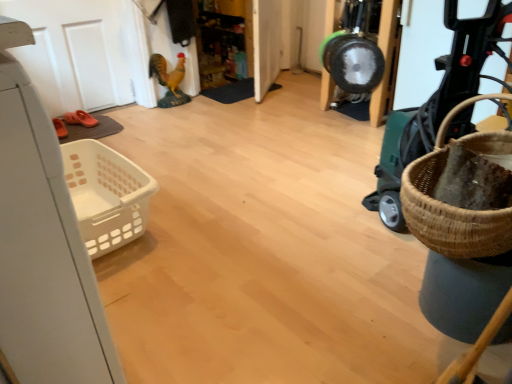
This screenshot has height=384, width=512. What do you see at coordinates (436, 104) in the screenshot?
I see `green plastic baby carriage at right` at bounding box center [436, 104].

At what (x,y) coordinates should I click in order to perform the action: click on orange rubber sandal at left. Please return your answer as a coordinate pair (x, y). The height and width of the screenshot is (384, 512). Looking at the image, I should click on (80, 119).

You are a GUI agent. You are given a task and a screenshot of the screen. Output one action in this format:
    pyautogui.click(x=<x>, y=<y>)
    Task: Click on the door located in front of the orange rubber sandal at left
    
    Given the screenshot: What is the action you would take?
    pyautogui.click(x=74, y=53)

Who is shorter, white matte door at upper left, which ranks as the 1th door in left-to-right order, or orange rubber sandal at left?

With less height is orange rubber sandal at left.

Between white matte door at upper left, acting as the 2th door starting from the right, and orange rubber sandal at left, which one has smaller width?

white matte door at upper left, acting as the 2th door starting from the right, is thinner.

Is white matte door at upper left, acting as the 2th door starting from the right, inside or outside of orange rubber sandal at left?

white matte door at upper left, acting as the 2th door starting from the right, cannot be found inside orange rubber sandal at left.

Is the surface of shiny plastic rooster at upper center in direct contact with green plastic baby carriage at right?

No, shiny plastic rooster at upper center is not touching green plastic baby carriage at right.

Between shiny plastic rooster at upper center and green plastic baby carriage at right, which one is positioned in front?

green plastic baby carriage at right is more forward.

I want to click on baby carriage that is above the shiny plastic rooster at upper center (from a real-world perspective), so click(436, 104).

Who is taller, shiny plastic rooster at upper center or green plastic baby carriage at right?

With more height is green plastic baby carriage at right.

Can you confirm if orange rubber sandal at left is positioned to the left of white glossy door at center, which ranks as the 1th door in right-to-left order?

Yes.

Find the location of a particular element. door on the right of orange rubber sandal at left is located at coordinates (266, 44).

Is the depth of orange rubber sandal at left less than that of white glossy door at center, which ranks as the 1th door in right-to-left order?

Yes, it is in front of white glossy door at center, which ranks as the 1th door in right-to-left order.

Which is in front, point (86, 121) or point (271, 54)?

The point (86, 121) is more forward.

Is white glossy door at center, which ranks as the 1th door in right-to-left order, placed right next to shiny plastic rooster at upper center?

No, white glossy door at center, which ranks as the 1th door in right-to-left order, is not touching shiny plastic rooster at upper center.

Considering the relative sizes of white glossy door at center, the second door when ordered from left to right, and shiny plastic rooster at upper center in the image provided, is white glossy door at center, the second door when ordered from left to right, wider than shiny plastic rooster at upper center?

No, white glossy door at center, the second door when ordered from left to right, is not wider than shiny plastic rooster at upper center.

From the image's perspective, is white glossy door at center, the second door when ordered from left to right, over shiny plastic rooster at upper center?

Correct, white glossy door at center, the second door when ordered from left to right, appears higher than shiny plastic rooster at upper center in the image.

Considering the positions of objects orange rubber sandal at left and green plastic baby carriage at right in the image provided, who is behind, orange rubber sandal at left or green plastic baby carriage at right?

Positioned behind is orange rubber sandal at left.

Looking at this image, can you tell me how much orange rubber sandal at left and green plastic baby carriage at right differ in facing direction?

orange rubber sandal at left and green plastic baby carriage at right are facing 142 degrees away from each other.

From the image's perspective, is orange rubber sandal at left above or below green plastic baby carriage at right?

orange rubber sandal at left is above green plastic baby carriage at right.

Does point (73, 119) come behind point (383, 221)?

Yes, it is.

Are white matte door at upper left, which ranks as the 1th door in left-to-right order, and shiny plastic rooster at upper center far apart?

No.

Consider the image. Considering the sizes of objects white matte door at upper left, acting as the 2th door starting from the right, and shiny plastic rooster at upper center in the image provided, who is taller, white matte door at upper left, acting as the 2th door starting from the right, or shiny plastic rooster at upper center?

white matte door at upper left, acting as the 2th door starting from the right, is taller.

Locate an element on the screen. The image size is (512, 384). toy that appears on the right of white matte door at upper left, acting as the 2th door starting from the right is located at coordinates (169, 80).

From the image's perspective, is white matte door at upper left, which ranks as the 1th door in left-to-right order, on top of shiny plastic rooster at upper center?

Indeed, from the image's perspective, white matte door at upper left, which ranks as the 1th door in left-to-right order, is shown above shiny plastic rooster at upper center.

Find the location of a particular element. The width and height of the screenshot is (512, 384). door lying on the right of white matte door at upper left, acting as the 2th door starting from the right is located at coordinates (266, 44).

What's the angular difference between white matte door at upper left, acting as the 2th door starting from the right, and white glossy door at center, the second door when ordered from left to right,'s facing directions?

142 degrees.

From the image's perspective, which object appears higher, white matte door at upper left, which ranks as the 1th door in left-to-right order, or white glossy door at center, which ranks as the 1th door in right-to-left order?

From the image's view, white glossy door at center, which ranks as the 1th door in right-to-left order, is above.

What are the coordinates of `the 1st door above when counting from the orange rubber sandal at left (from the image's perspective)` in the screenshot? It's located at (74, 53).

The height and width of the screenshot is (384, 512). Find the location of `baby carriage that appears in front of the shiny plastic rooster at upper center`. baby carriage that appears in front of the shiny plastic rooster at upper center is located at coordinates (436, 104).

Which object lies nearer to the anchor point green plastic baby carriage at right, white glossy door at center, which ranks as the 1th door in right-to-left order, or shiny plastic rooster at upper center?

white glossy door at center, which ranks as the 1th door in right-to-left order, lies closer to green plastic baby carriage at right than the other object.

Estimate the real-world distances between objects in this image. Which object is closer to white matte door at upper left, acting as the 2th door starting from the right, green plastic baby carriage at right or orange rubber sandal at left?

Based on the image, orange rubber sandal at left appears to be nearer to white matte door at upper left, acting as the 2th door starting from the right.

From the image, which object appears to be nearer to shiny plastic rooster at upper center, orange rubber sandal at left or white glossy door at center, the second door when ordered from left to right?

Among the two, orange rubber sandal at left is located nearer to shiny plastic rooster at upper center.

Estimate the real-world distances between objects in this image. Which object is further from orange rubber sandal at left, green plastic baby carriage at right or shiny plastic rooster at upper center?

Based on the image, green plastic baby carriage at right appears to be further to orange rubber sandal at left.

Based on their spatial positions, is green plastic baby carriage at right or white matte door at upper left, acting as the 2th door starting from the right, closer to shiny plastic rooster at upper center?

white matte door at upper left, acting as the 2th door starting from the right, lies closer to shiny plastic rooster at upper center than the other object.

Based on their spatial positions, is white glossy door at center, the second door when ordered from left to right, or white matte door at upper left, which ranks as the 1th door in left-to-right order, closer to green plastic baby carriage at right?

white glossy door at center, the second door when ordered from left to right, is closer to green plastic baby carriage at right.

From the image, which object appears to be farther from shiny plastic rooster at upper center, orange rubber sandal at left or green plastic baby carriage at right?

The object further to shiny plastic rooster at upper center is green plastic baby carriage at right.

Looking at the image, which one is located closer to green plastic baby carriage at right, white glossy door at center, the second door when ordered from left to right, or orange rubber sandal at left?

Among the two, white glossy door at center, the second door when ordered from left to right, is located nearer to green plastic baby carriage at right.

At what (x,y) coordinates should I click in order to perform the action: click on footwear situated between white matte door at upper left, which ranks as the 1th door in left-to-right order, and shiny plastic rooster at upper center from left to right. Please return your answer as a coordinate pair (x, y). The height and width of the screenshot is (384, 512). Looking at the image, I should click on (80, 119).

The height and width of the screenshot is (384, 512). What are the coordinates of `toy between orange rubber sandal at left and white glossy door at center, the second door when ordered from left to right, in the horizontal direction` in the screenshot? It's located at [x=169, y=80].

Where is `toy situated between white matte door at upper left, which ranks as the 1th door in left-to-right order, and white glossy door at center, which ranks as the 1th door in right-to-left order, from left to right`? toy situated between white matte door at upper left, which ranks as the 1th door in left-to-right order, and white glossy door at center, which ranks as the 1th door in right-to-left order, from left to right is located at coordinates (169, 80).

Find the location of `toy situated between white matte door at upper left, which ranks as the 1th door in left-to-right order, and green plastic baby carriage at right from left to right`. toy situated between white matte door at upper left, which ranks as the 1th door in left-to-right order, and green plastic baby carriage at right from left to right is located at coordinates (169, 80).